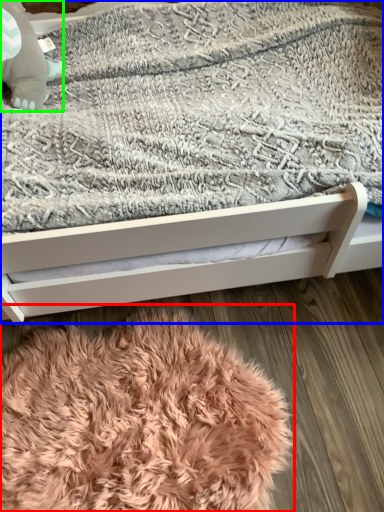
Question: Which is farther away from blanket (highlighted by a red box)? bed (highlighted by a blue box) or baby elephant (highlighted by a green box)?

Choices:
 (A) bed
 (B) baby elephant

Answer: (B)